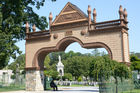
This screenshot has width=140, height=93. I want to click on pillar, so click(x=31, y=81).